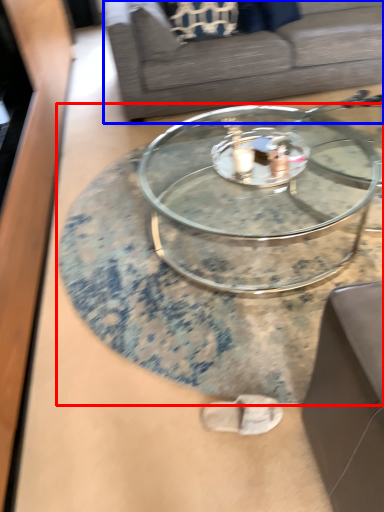
Question: Which point is further to the camera, coffee table (highlighted by a red box) or studio couch (highlighted by a blue box)?

Choices:
 (A) coffee table
 (B) studio couch

Answer: (B)